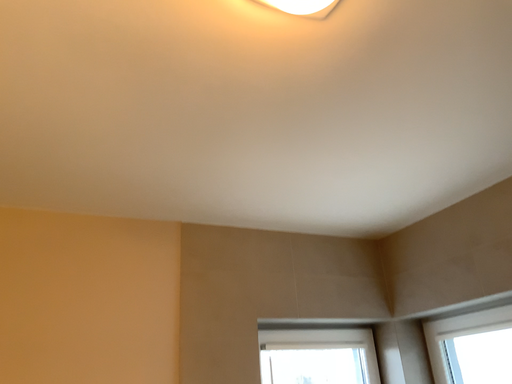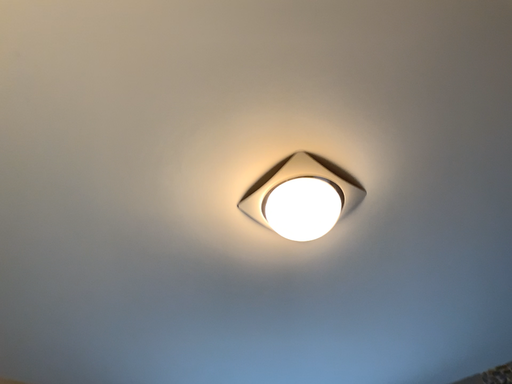
Question: How did the camera likely rotate when shooting the video?

Choices:
 (A) rotated upward
 (B) rotated downward

Answer: (A)